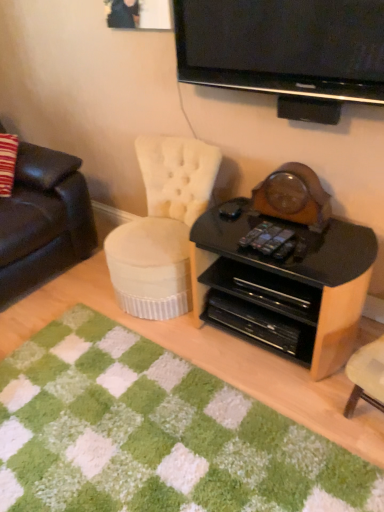
The height and width of the screenshot is (512, 384). In order to click on vacant space that is to the left of white tufted fabric chair at center in this screenshot , I will do `click(76, 297)`.